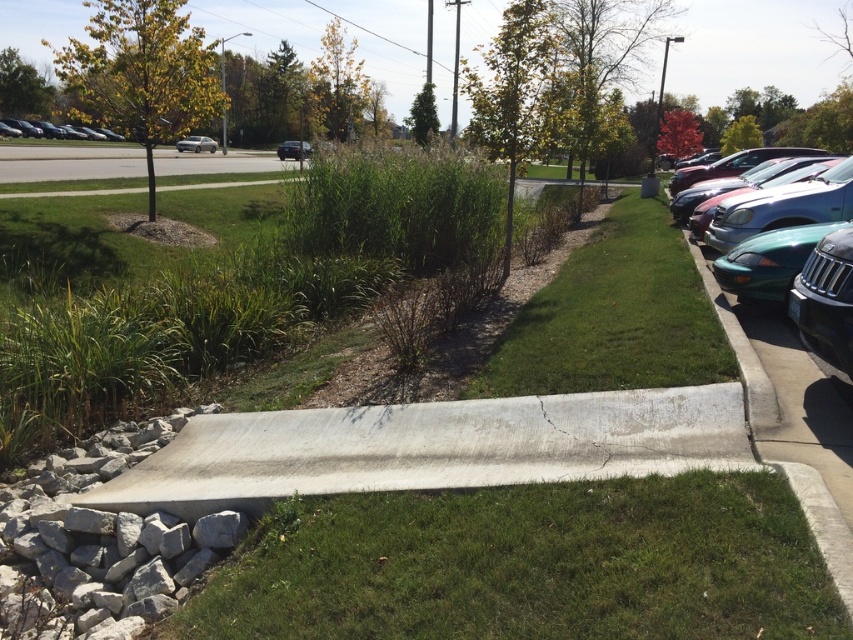
You are standing at the point marked by coordinates [527,564] in the parking lot scene. What is the color of the ground beneath your feet?

The green grass at center is located at point [527,564], so the ground beneath your feet is green grass.

You are standing at the center of the parking lot and want to walk towards the green grass at right. In which direction should you head?

The green grass at right is located at point (613, 317), which is to the right side of the parking lot. Therefore, you should head towards the right direction to reach it.